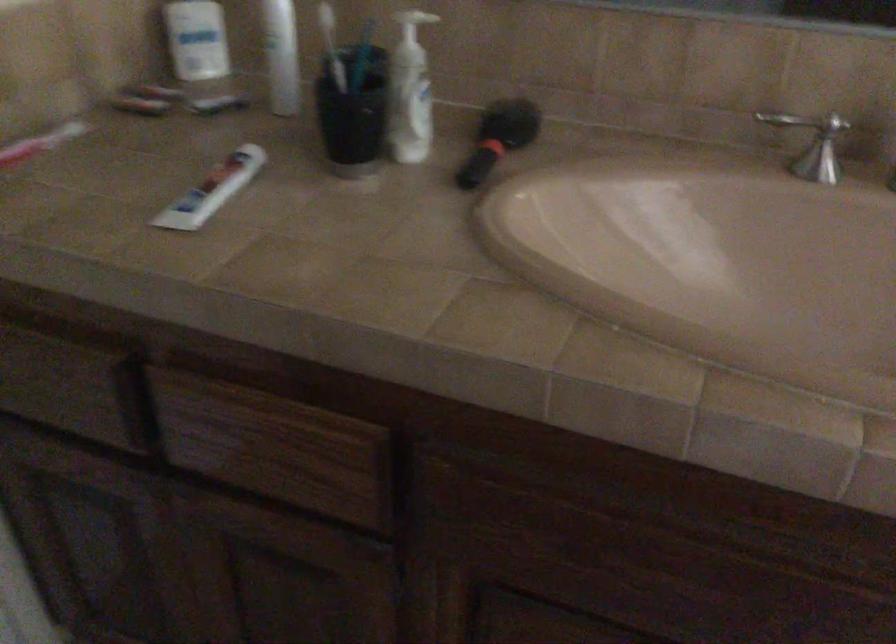
I want to click on white toothpaste tube, so click(x=211, y=190).